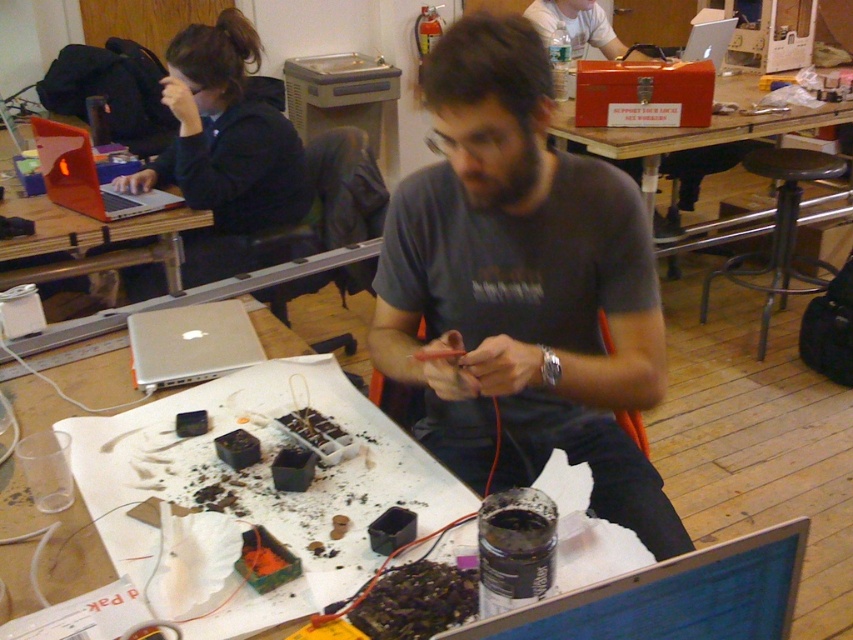
Question: From the image, what is the correct spatial relationship of dark gray t-shirt at center in relation to matte black laptop at left?

Choices:
 (A) below
 (B) above

Answer: (A)

Question: Which of the following is the closest to the observer?

Choices:
 (A) metallic silver laptop at upper left
 (B) dark gray t-shirt at center
 (C) silver metallic laptop at center
 (D) orange metal toolbox at upper center

Answer: (B)

Question: Is metallic silver laptop at upper left below metallic stool at right?

Choices:
 (A) yes
 (B) no

Answer: (A)

Question: Based on their relative distances, which object is farther from the dark gray t-shirt at center?

Choices:
 (A) black plastic laptop at center
 (B) matte black laptop at left
 (C) silver metallic laptop at center

Answer: (B)

Question: Is metallic stool at right wider than silver metallic laptop at upper center?

Choices:
 (A) yes
 (B) no

Answer: (A)

Question: Which point is closer to the camera taking this photo?

Choices:
 (A) (784, 536)
 (B) (759, 131)

Answer: (A)